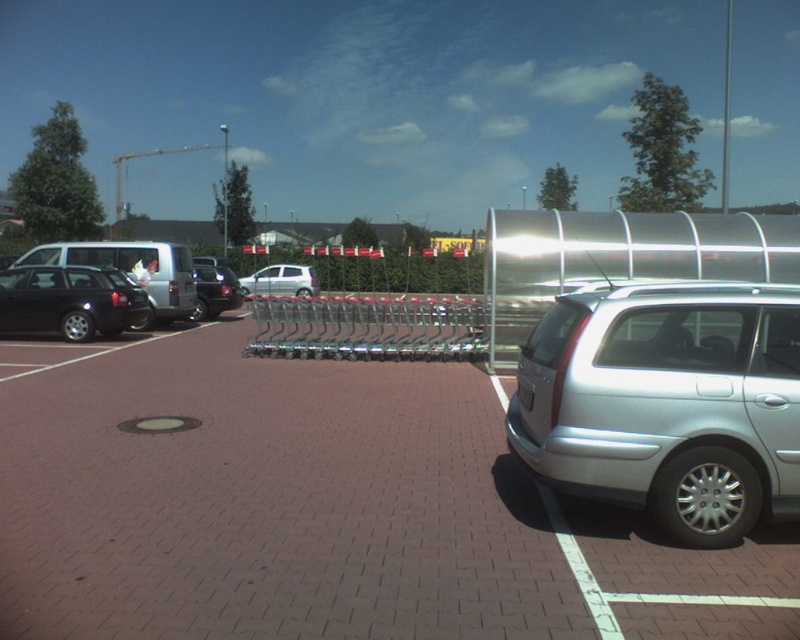
Question: Considering the real-world distances, which object is closest to the black plastic license plate at lower right?

Choices:
 (A) shiny black sedan at left
 (B) matte black suv at left
 (C) silver metallic hatchback at center

Answer: (A)

Question: Can you confirm if silver metallic minivan at right is positioned below shiny black sedan at center?

Choices:
 (A) no
 (B) yes

Answer: (B)

Question: Does silver metallic minivan at right appear under silver metallic hatchback at center?

Choices:
 (A) yes
 (B) no

Answer: (A)

Question: Considering the real-world distances, which object is farthest from the silver metallic minivan at right?

Choices:
 (A) shiny black sedan at left
 (B) brick pavement at center

Answer: (A)

Question: Which point appears closest to the camera in this image?

Choices:
 (A) (128, 259)
 (B) (540, 432)

Answer: (B)

Question: Is matte black suv at left thinner than shiny black sedan at center?

Choices:
 (A) no
 (B) yes

Answer: (A)